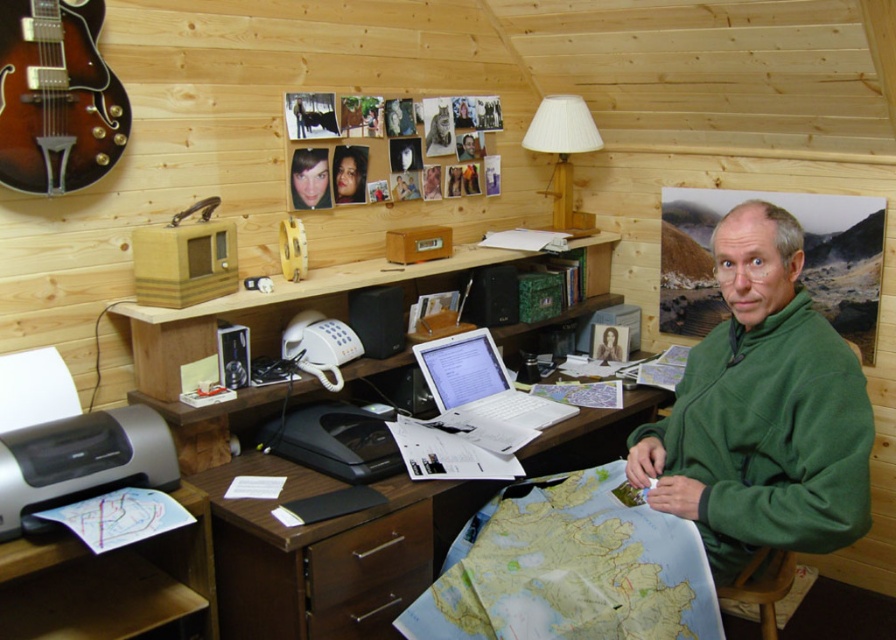
Can you confirm if blue paper map at lower right is positioned below wooden drawer at lower center?

No, blue paper map at lower right is not below wooden drawer at lower center.

Does point (428, 636) come behind point (367, 604)?

No, it is not.

This screenshot has height=640, width=896. Describe the element at coordinates (570, 570) in the screenshot. I see `blue paper map at lower right` at that location.

Locate an element on the screen. The width and height of the screenshot is (896, 640). blue paper map at lower right is located at coordinates (570, 570).

How distant is brown wood computer desk at center from blue paper map at lower right?

brown wood computer desk at center and blue paper map at lower right are 17.41 inches apart.

Can you confirm if brown wood computer desk at center is positioned below blue paper map at lower right?

Actually, brown wood computer desk at center is above blue paper map at lower right.

This screenshot has width=896, height=640. Find the location of `brown wood computer desk at center`. brown wood computer desk at center is located at coordinates (274, 518).

How far apart are brown wood drawer at lower center and wooden drawer at lower center?

A distance of 3.03 inches exists between brown wood drawer at lower center and wooden drawer at lower center.

From the picture: Is brown wood drawer at lower center below wooden drawer at lower center?

Incorrect, brown wood drawer at lower center is not positioned below wooden drawer at lower center.

Measure the distance between brown wood drawer at lower center and camera.

brown wood drawer at lower center and camera are 1.67 meters apart from each other.

Where is `brown wood drawer at lower center`? The width and height of the screenshot is (896, 640). brown wood drawer at lower center is located at coordinates (367, 556).